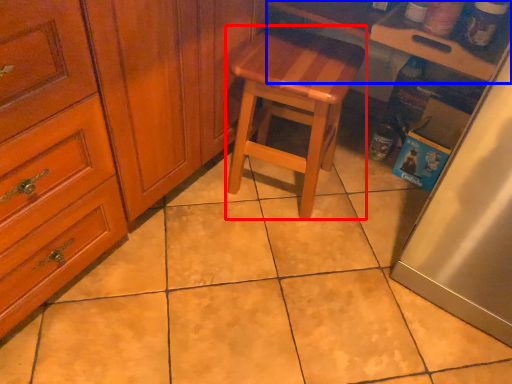
Question: Among these objects, which one is farthest to the camera, stool (highlighted by a red box) or counter top (highlighted by a blue box)?

Choices:
 (A) stool
 (B) counter top

Answer: (A)